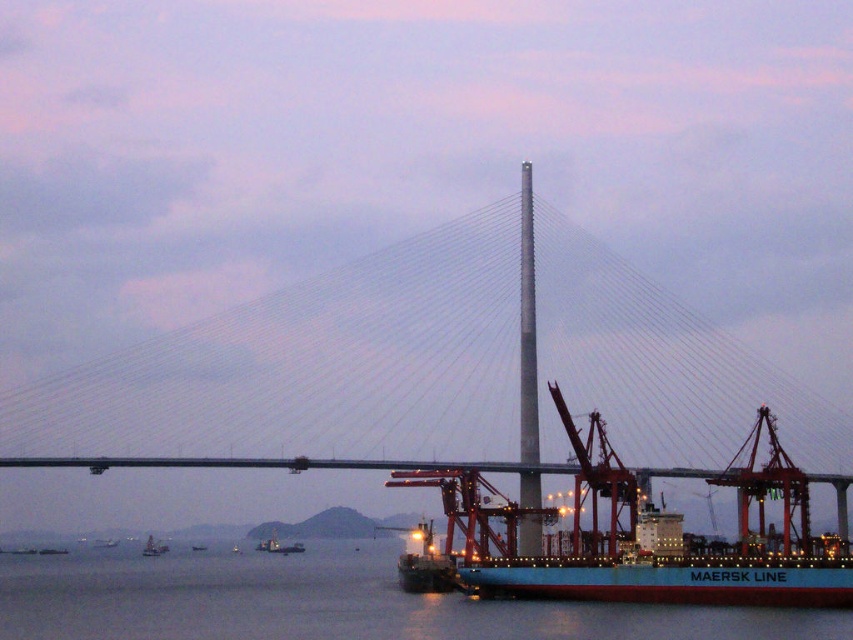
Who is positioned more to the left, smooth gray bridge at center or blue water at lower center?

blue water at lower center

Does smooth gray bridge at center appear under blue water at lower center?

No.

Measure the distance between smooth gray bridge at center and camera.

The distance of smooth gray bridge at center from camera is 263.97 meters.

The image size is (853, 640). What are the coordinates of `smooth gray bridge at center` in the screenshot? It's located at (402, 388).

Is smooth gray bridge at center taller than metallic blue ship at center?

Correct, smooth gray bridge at center is much taller as metallic blue ship at center.

What do you see at coordinates (402, 388) in the screenshot? I see `smooth gray bridge at center` at bounding box center [402, 388].

Locate an element on the screen. The width and height of the screenshot is (853, 640). smooth gray bridge at center is located at coordinates (402, 388).

Between smooth gray bridge at center and metallic gray boat at lower left, which one appears on the right side from the viewer's perspective?

From the viewer's perspective, smooth gray bridge at center appears more on the right side.

Does smooth gray bridge at center have a smaller size compared to metallic gray boat at lower left?

Actually, smooth gray bridge at center might be larger than metallic gray boat at lower left.

Does point (524, 368) come behind point (144, 548)?

No.

Locate an element on the screen. Image resolution: width=853 pixels, height=640 pixels. smooth gray bridge at center is located at coordinates (402, 388).